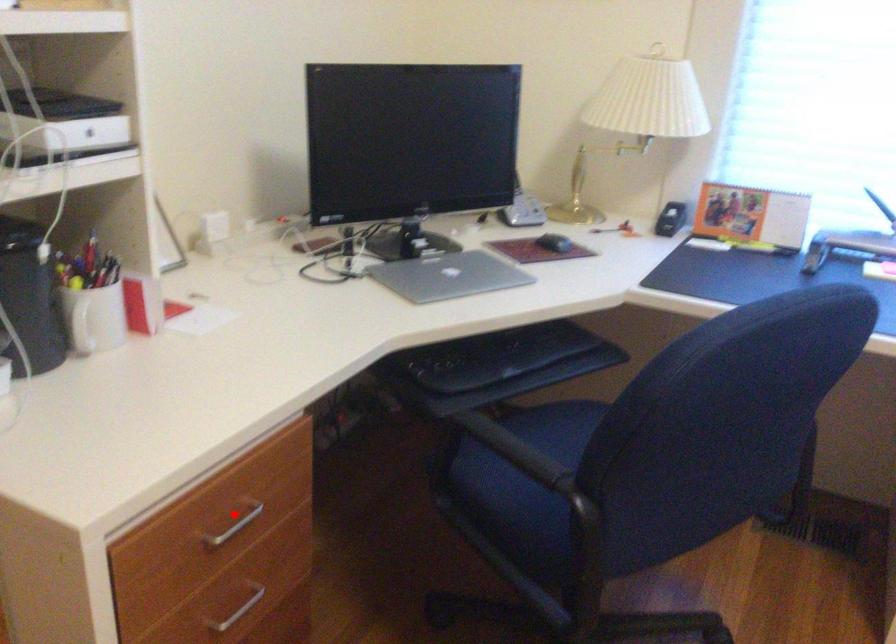
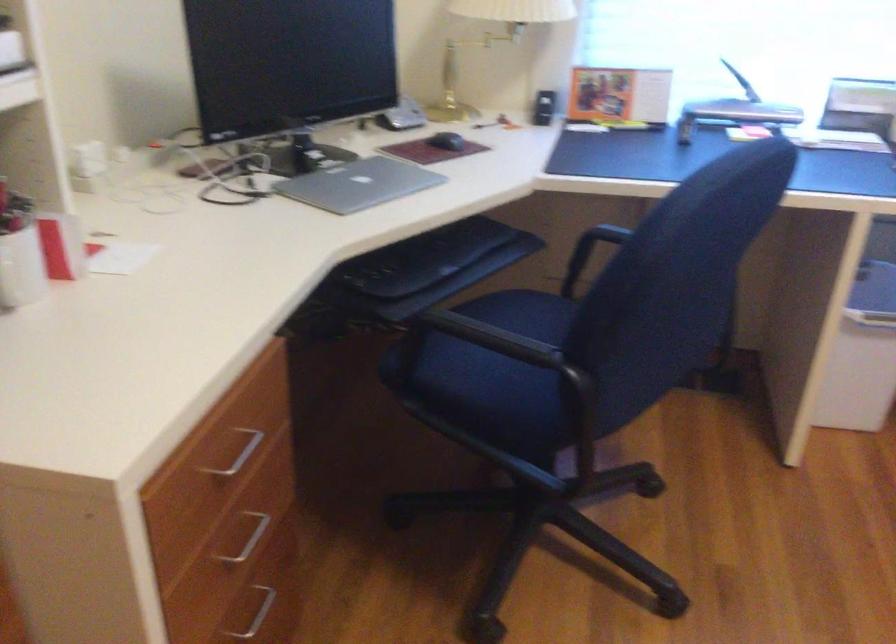
Find the pixel in the second image that matches the highlighted location in the first image.

(238, 453)